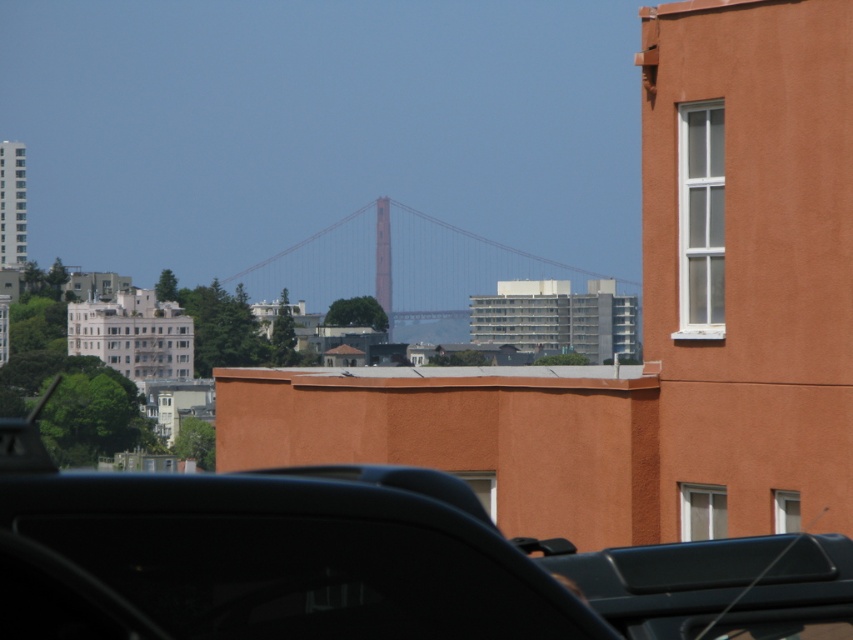
Is shiny black car at center taller than red painted steel suspension bridge at center?

No.

What do you see at coordinates (366, 563) in the screenshot? I see `shiny black car at center` at bounding box center [366, 563].

Where is `shiny black car at center`? shiny black car at center is located at coordinates (366, 563).